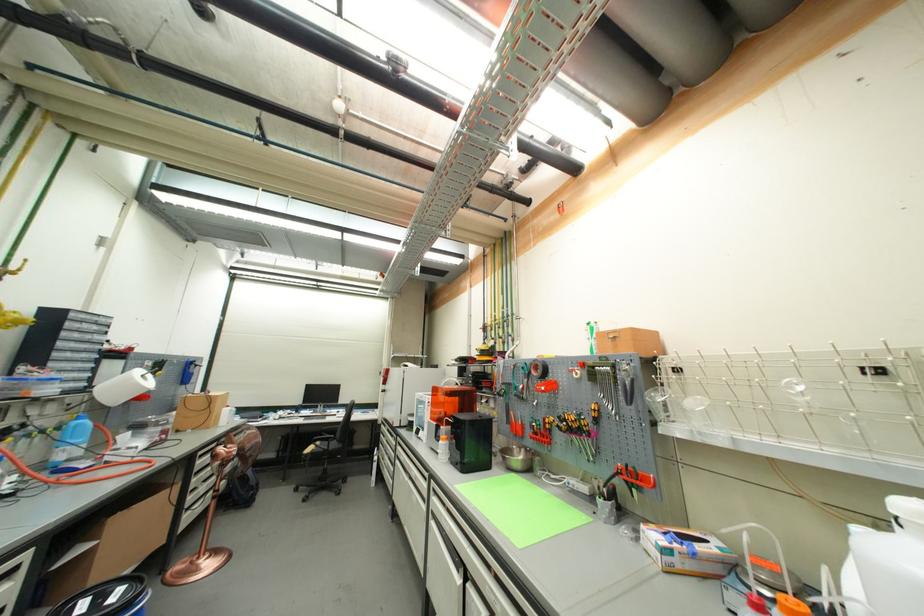
Find the location of a particular element. chair armrest is located at coordinates (327, 458).